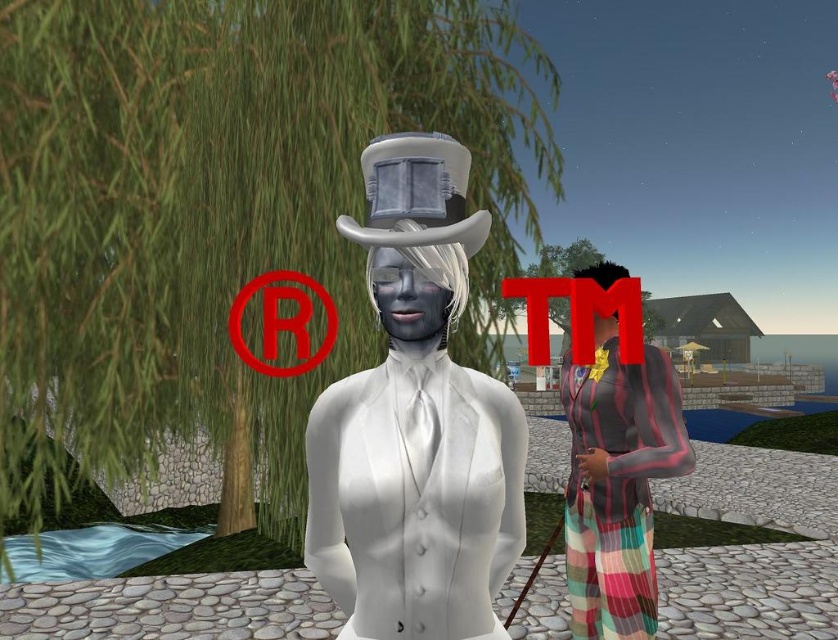
Question: Among these objects, which one is nearest to the camera?

Choices:
 (A) striped fabric dress at right
 (B) white matte suit at center

Answer: (B)

Question: Considering the real-world distances, which object is farthest from the striped fabric dress at right?

Choices:
 (A) white matte suit at center
 (B) white matte top hat at center

Answer: (B)

Question: Which point is farther to the camera?

Choices:
 (A) (611, 554)
 (B) (437, 237)

Answer: (A)

Question: In this image, where is white matte suit at center located relative to white matte top hat at center?

Choices:
 (A) left
 (B) right

Answer: (A)

Question: Does white matte suit at center have a larger size compared to white matte top hat at center?

Choices:
 (A) no
 (B) yes

Answer: (B)

Question: Is striped fabric dress at right further to the viewer compared to white matte top hat at center?

Choices:
 (A) yes
 (B) no

Answer: (A)